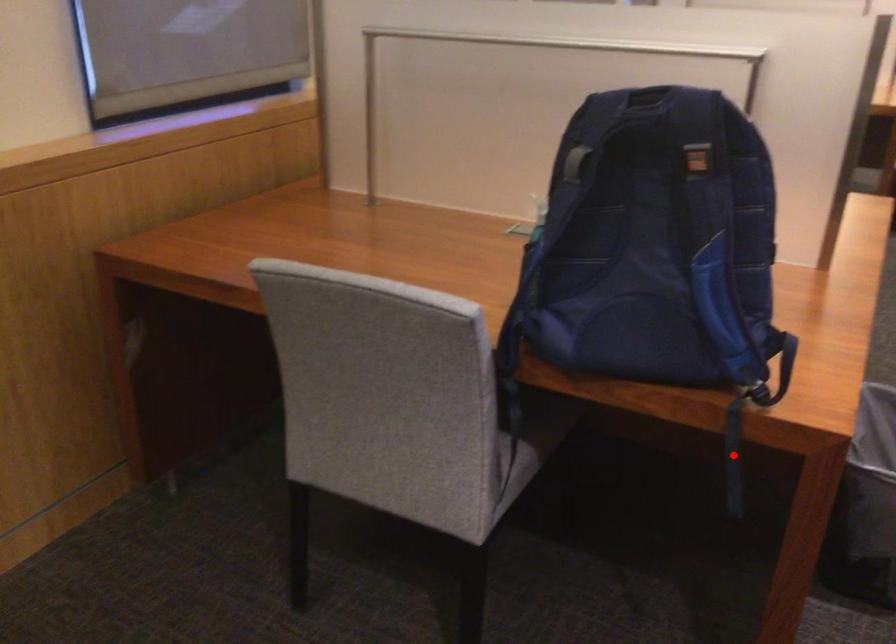
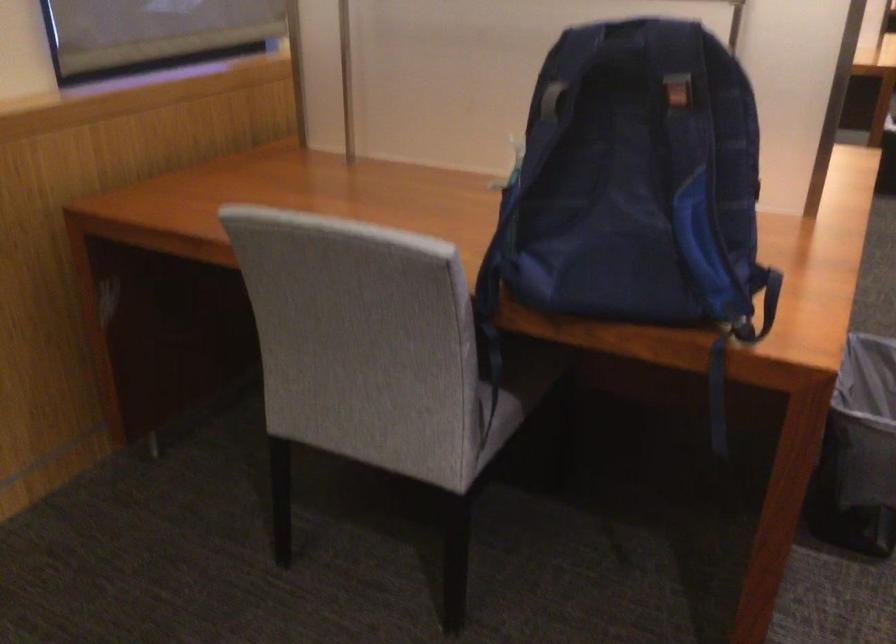
Find the pixel in the second image that matches the highlighted location in the first image.

(718, 395)